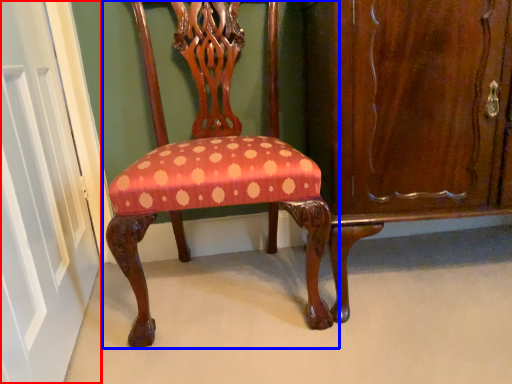
Question: Which object appears closest to the camera in this image, door (highlighted by a red box) or chair (highlighted by a blue box)?

Choices:
 (A) door
 (B) chair

Answer: (A)